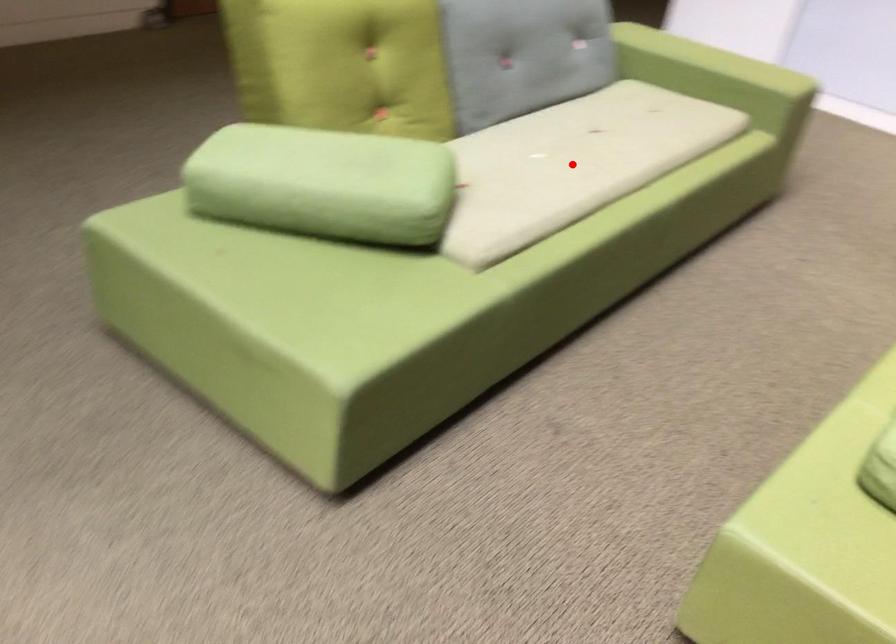
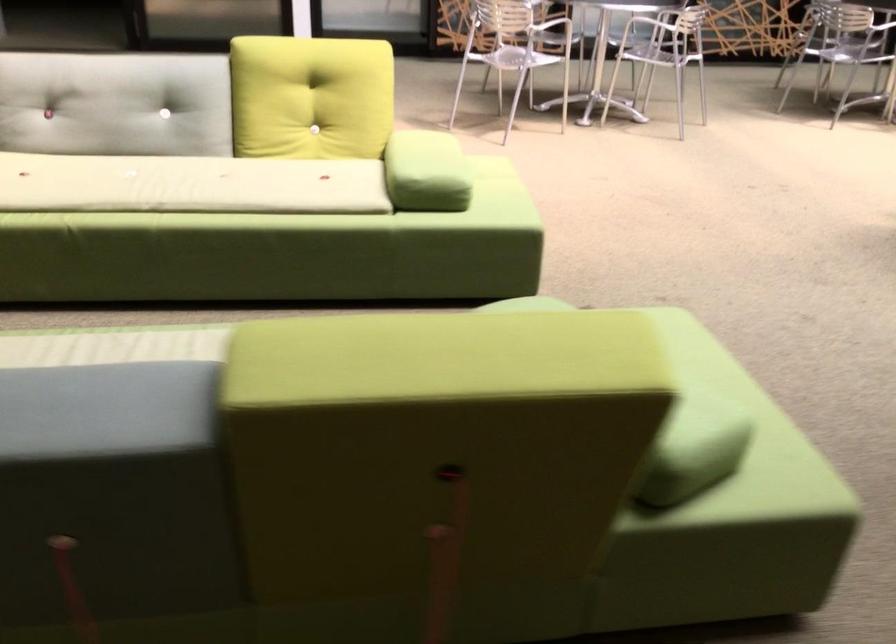
Question: I am providing you with two images of the same scene from different viewpoints. A red point is marked on the first image. At the location where the point appears in image 1, is it still visible in image 2?

Choices:
 (A) Yes
 (B) No

Answer: (B)